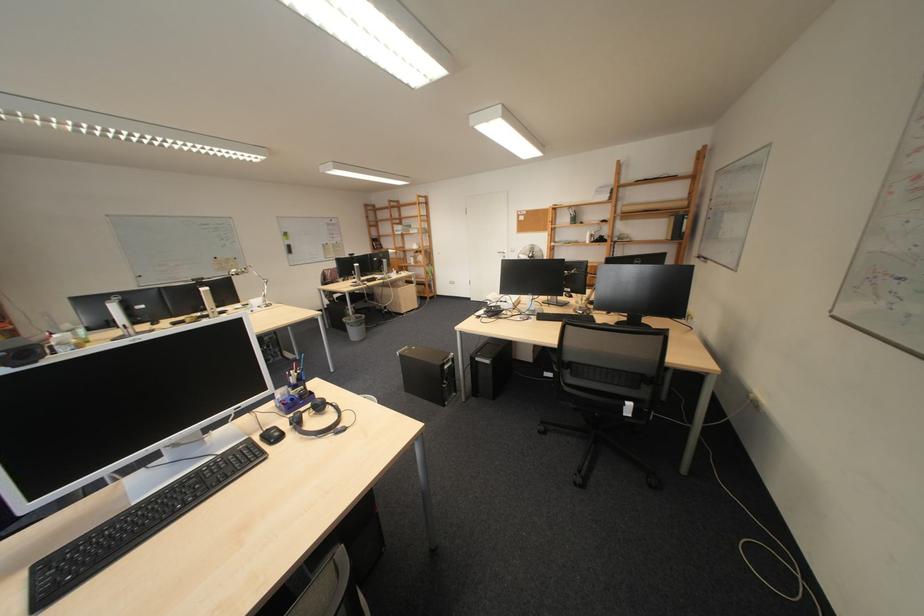
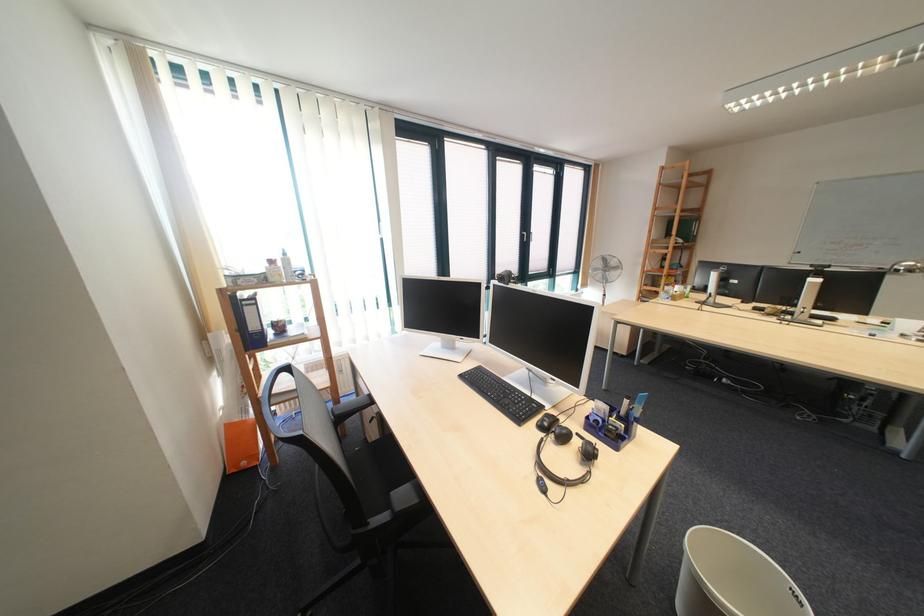
Where in the second image is the point corresponding to (x=347, y=428) from the first image?

(563, 476)